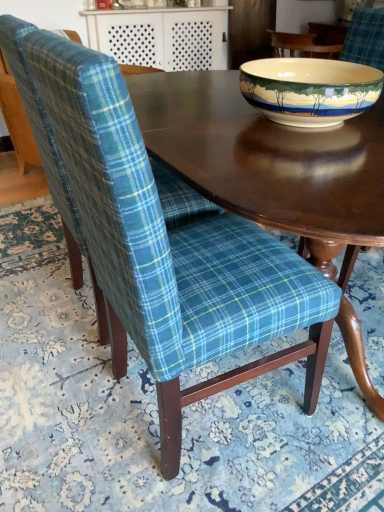
Question: Is point (51, 197) positioned closer to the camera than point (266, 74)?

Choices:
 (A) farther
 (B) closer

Answer: (A)

Question: Considering the relative positions of blue plaid fabric chair at left, the 1th chair positioned from the back, and porcelain bowl at upper right in the image provided, is blue plaid fabric chair at left, the 1th chair positioned from the back, to the left or to the right of porcelain bowl at upper right?

Choices:
 (A) right
 (B) left

Answer: (B)

Question: Estimate the real-world distances between objects in this image. Which object is closer to the teal plaid fabric chair at center, marked as the first chair in a front-to-back arrangement?

Choices:
 (A) smooth dark wood table at upper center
 (B) porcelain bowl at upper right
 (C) blue plaid fabric chair at left, the second chair positioned from the front

Answer: (C)

Question: Which object is positioned closest to the blue plaid fabric chair at left, the second chair positioned from the front?

Choices:
 (A) smooth dark wood table at upper center
 (B) porcelain bowl at upper right
 (C) teal plaid fabric chair at center, marked as the first chair in a front-to-back arrangement

Answer: (C)